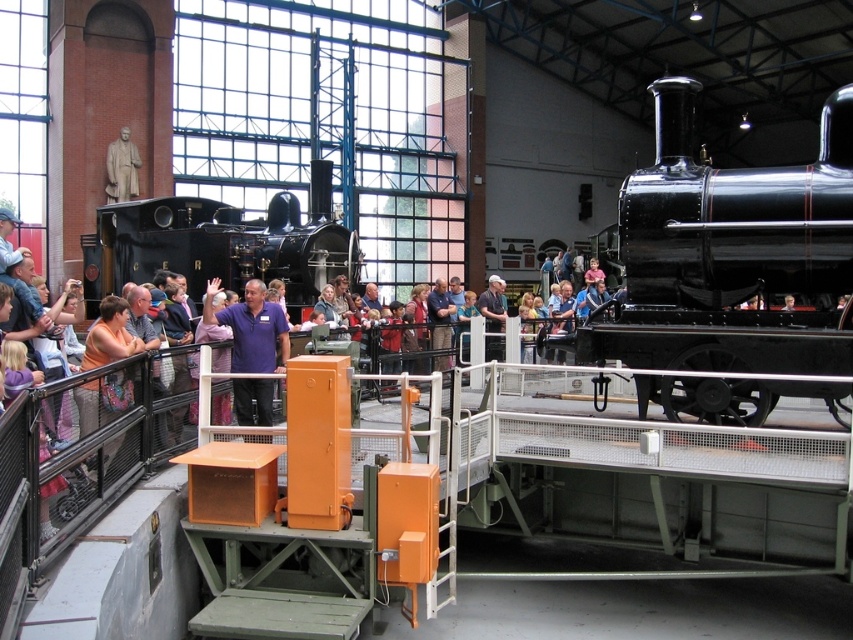
Question: Which of the following is the closest to the observer?

Choices:
 (A) (288, 282)
 (B) (256, 316)

Answer: (B)

Question: Which point is closer to the camera taking this photo?

Choices:
 (A) (253, 362)
 (B) (294, 196)
 (C) (761, 253)

Answer: (C)

Question: Among these points, which one is farthest from the camera?

Choices:
 (A) (672, 161)
 (B) (265, 330)

Answer: (B)

Question: Is polished black steam locomotive at center wider than purple shirt at center?

Choices:
 (A) yes
 (B) no

Answer: (B)

Question: Is black polished locomotive at center below polished black steam locomotive at center?

Choices:
 (A) no
 (B) yes

Answer: (B)

Question: Does black polished locomotive at center have a lesser width compared to polished black steam locomotive at center?

Choices:
 (A) no
 (B) yes

Answer: (A)